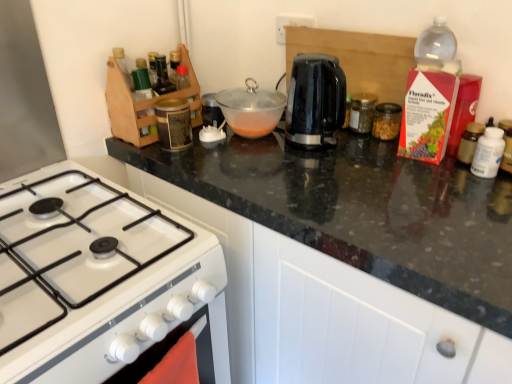
Identify the location of vacant space in front of black glossy electric kettle at center, the fourth kitchen appliance viewed from the right. The image size is (512, 384). (327, 172).